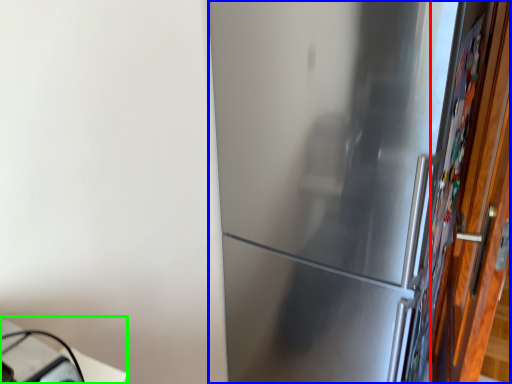
Question: Considering the real-world distances, which object is farthest from door (highlighted by a red box)? refrigerator (highlighted by a blue box) or table (highlighted by a green box)?

Choices:
 (A) refrigerator
 (B) table

Answer: (B)